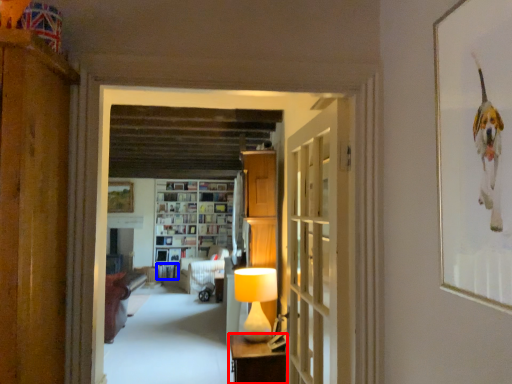
Question: Among these objects, which one is nearest to the camera, furniture (highlighted by a red box) or book (highlighted by a blue box)?

Choices:
 (A) furniture
 (B) book

Answer: (A)